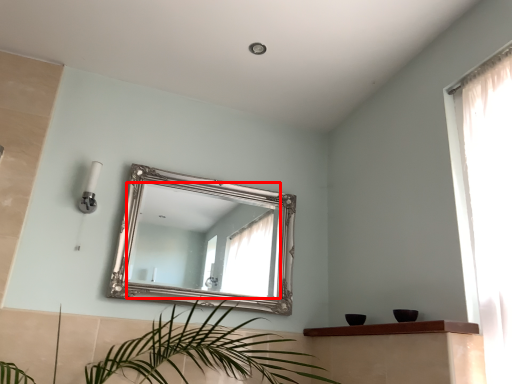
Question: From the image's perspective, what is the correct spatial positioning of mirror (annotated by the red box) in reference to balustrade?

Choices:
 (A) below
 (B) above

Answer: (B)